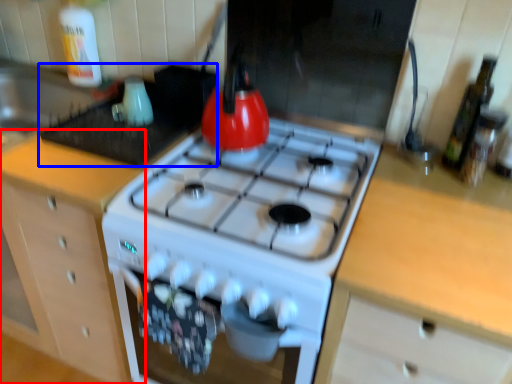
Question: Which object appears farthest to the camera in this image, cabinetry (highlighted by a red box) or appliance (highlighted by a blue box)?

Choices:
 (A) cabinetry
 (B) appliance

Answer: (B)